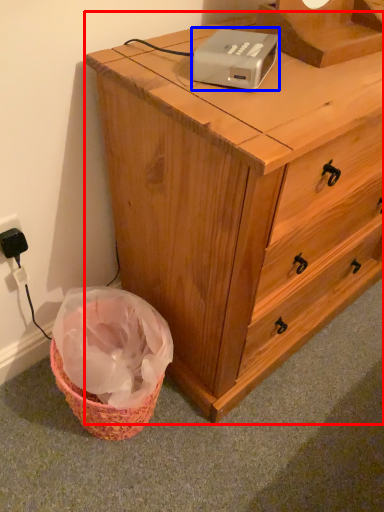
Question: Which object is further to the camera taking this photo, chest of drawers (highlighted by a red box) or gadget (highlighted by a blue box)?

Choices:
 (A) chest of drawers
 (B) gadget

Answer: (B)